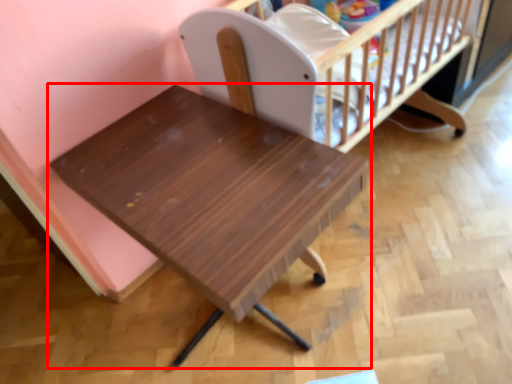
Question: From the image's perspective, where is table (annotated by the red box) located in relation to infant bed in the image?

Choices:
 (A) below
 (B) above

Answer: (A)